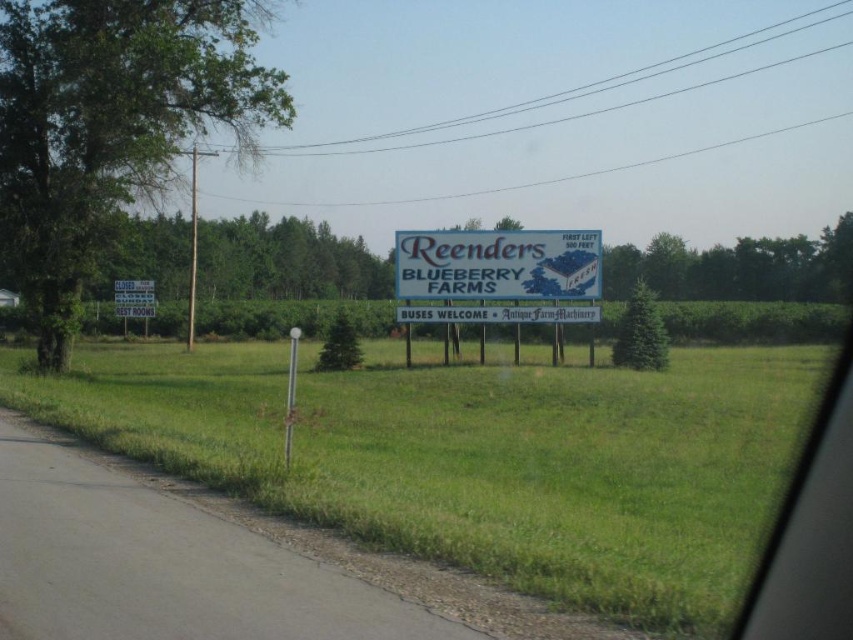
You are a passenger in a car driving past the billboard. You notice the point at coordinate point (810, 532) on the transparent glass car window at center. Where is this point located relative to the transparent glass car window at center?

The point at coordinate point (810, 532) is located at the center of the transparent glass car window at center.

You are driving a car and see the road ahead with the transparent glass car window at center and the white plastic sign at center. Which object is positioned to the right from your perspective?

The transparent glass car window at center is positioned to the right of the white plastic sign at center from your perspective.

You are a passenger in a car driving past the Reenders Blueberry Farms billboard. You want to read the text on the sign but notice something about the transparent glass car window at center. What might be obstructing your view of the billboard text?

The transparent glass car window at center is positioned at point (810, 532), which might be causing a reflection or glare that obstructs the view of the billboard text.